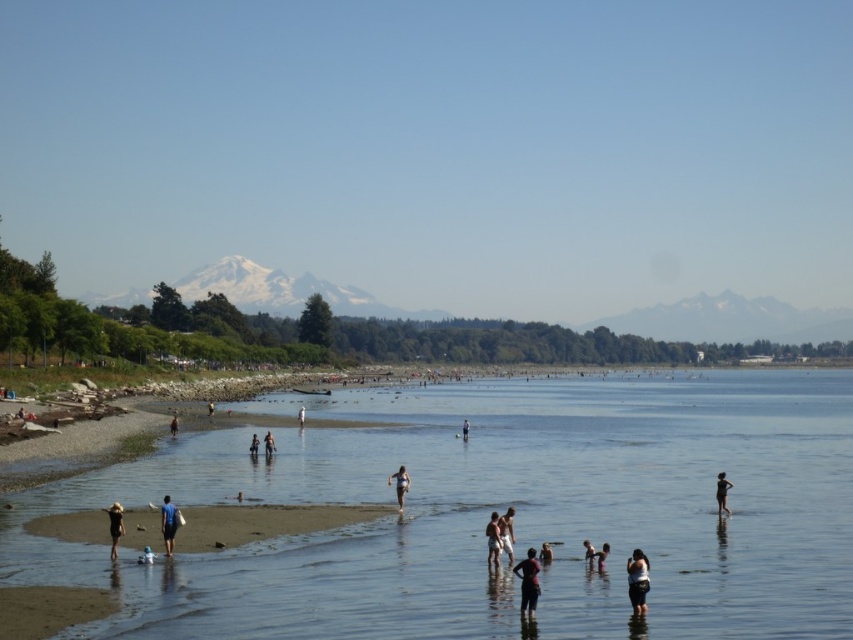
Question: Can you confirm if light blue fabric at center is positioned to the right of white fabric person at center?

Choices:
 (A) no
 (B) yes

Answer: (B)

Question: Which point is closer to the camera?

Choices:
 (A) (403, 468)
 (B) (271, 454)

Answer: (A)

Question: Estimate the real-world distances between objects in this image. Which object is farther from the white fabric person at center?

Choices:
 (A) dark blue surfboard at lower left
 (B) dark blue fabric at lower center

Answer: (B)

Question: Is smooth skin person at lower center bigger than white fabric person at center?

Choices:
 (A) no
 (B) yes

Answer: (A)

Question: Which of the following is the closest to the observer?

Choices:
 (A) (167, 524)
 (B) (172, 422)
 (C) (726, 486)

Answer: (A)

Question: Does light blue fabric swimsuit at center appear under white cotton shirt at lower center?

Choices:
 (A) no
 (B) yes

Answer: (B)